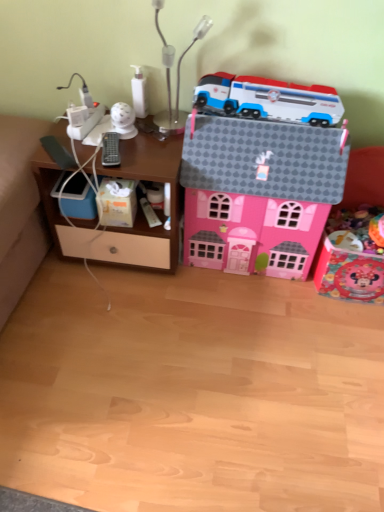
Question: Can we say white glossy bottle at upper center, positioned as the 5th toy in right-to-left order, lies outside white plastic train at upper center, arranged as the fourth toy when viewed from the left?

Choices:
 (A) yes
 (B) no

Answer: (A)

Question: Does white glossy bottle at upper center, positioned as the 5th toy in right-to-left order, have a larger size compared to white plastic train at upper center, arranged as the fourth toy when viewed from the left?

Choices:
 (A) yes
 (B) no

Answer: (B)

Question: From the image's perspective, is white glossy bottle at upper center, positioned as the 5th toy in right-to-left order, under white plastic train at upper center, which is the 3th toy in right-to-left order?

Choices:
 (A) no
 (B) yes

Answer: (A)

Question: From the image's perspective, is white glossy bottle at upper center, positioned as the 5th toy in right-to-left order, over white plastic train at upper center, which is the 3th toy in right-to-left order?

Choices:
 (A) no
 (B) yes

Answer: (B)

Question: From a real-world perspective, is white glossy bottle at upper center, positioned as the 5th toy in right-to-left order, beneath white plastic train at upper center, arranged as the fourth toy when viewed from the left?

Choices:
 (A) no
 (B) yes

Answer: (B)

Question: Based on their sizes in the image, would you say pink cardboard house at center, which appears as the 2th toy when viewed from the right, is bigger or smaller than white matte tissue box at lower left?

Choices:
 (A) big
 (B) small

Answer: (A)

Question: Is pink cardboard house at center, which appears as the 2th toy when viewed from the right, taller or shorter than white matte tissue box at lower left?

Choices:
 (A) tall
 (B) short

Answer: (A)

Question: Considering their positions, is pink cardboard house at center, which appears as the 2th toy when viewed from the right, located in front of or behind white matte tissue box at lower left?

Choices:
 (A) front
 (B) behind

Answer: (A)

Question: Looking at their shapes, would you say pink cardboard house at center, the 5th toy from the left, is wider or thinner than white matte tissue box at lower left?

Choices:
 (A) wide
 (B) thin

Answer: (A)

Question: Is point (x=109, y=204) positioned closer to the camera than point (x=165, y=140)?

Choices:
 (A) farther
 (B) closer

Answer: (A)

Question: From a real-world perspective, is white matte tissue box at lower left physically located above or below woodenmaterial/texturecomputer desk at left?

Choices:
 (A) above
 (B) below

Answer: (A)

Question: Considering the positions of white matte tissue box at lower left and woodenmaterial/texturecomputer desk at left in the image, is white matte tissue box at lower left taller or shorter than woodenmaterial/texturecomputer desk at left?

Choices:
 (A) short
 (B) tall

Answer: (A)

Question: Based on their sizes in the image, would you say white matte tissue box at lower left is bigger or smaller than woodenmaterial/texturecomputer desk at left?

Choices:
 (A) big
 (B) small

Answer: (B)

Question: Is white glossy security camera at upper center, the sixth toy positioned from the right, taller or shorter than metallic silver table lamp at upper center?

Choices:
 (A) short
 (B) tall

Answer: (A)

Question: From a real-world perspective, relative to metallic silver table lamp at upper center, is white glossy security camera at upper center, which is counted as the first toy, starting from the left, vertically above or below?

Choices:
 (A) below
 (B) above

Answer: (A)